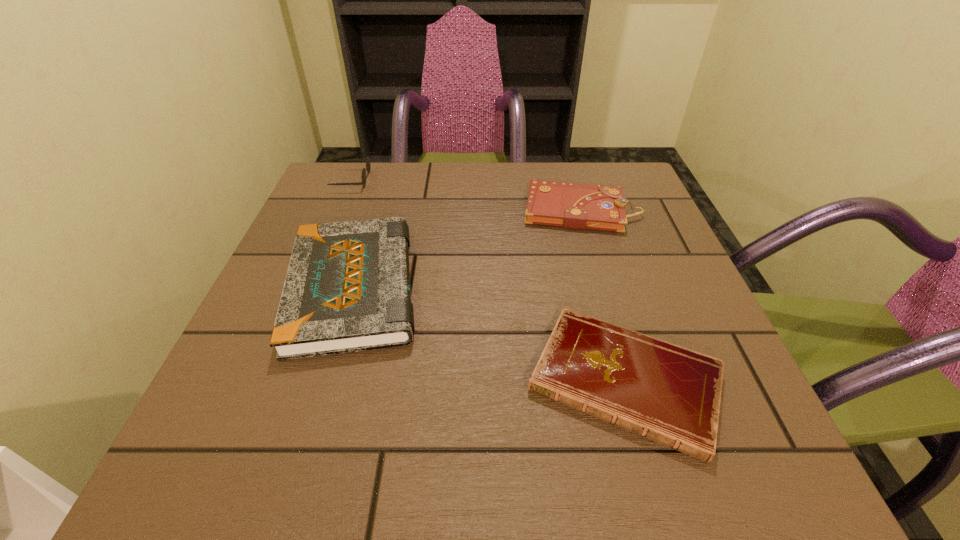
The height and width of the screenshot is (540, 960). I want to click on object identified as the closest to the second shortest object, so click(347, 289).

Identify which object is the third nearest to the leftmost notebook. Please provide its 2D coordinates. Your answer should be formatted as a tuple, i.e. [(x, y)], where the tuple contains the x and y coordinates of a point satisfying the conditions above.

[(579, 206)]

Where is `notebook that can be found as the closest to the sunglasses`? This screenshot has width=960, height=540. notebook that can be found as the closest to the sunglasses is located at coordinates [x=347, y=289].

What are the coordinates of `notebook that is the closest to the shortest notebook` in the screenshot? It's located at (347, 289).

Find the location of a particular element. The width and height of the screenshot is (960, 540). vacant point that satisfies the following two spatial constraints: 1. on the back side of the leftmost notebook; 2. on the front-facing side of the sunglasses is located at coordinates (385, 180).

The image size is (960, 540). What are the coordinates of `free space that satisfies the following two spatial constraints: 1. on the front-facing side of the leftmost notebook; 2. on the right side of the sunglasses` in the screenshot? It's located at (307, 288).

The width and height of the screenshot is (960, 540). In order to click on blank area in the image that satisfies the following two spatial constraints: 1. on the front-facing side of the leftmost notebook; 2. on the left side of the sunglasses in this screenshot , I will do `click(307, 288)`.

The height and width of the screenshot is (540, 960). In order to click on free spot that satisfies the following two spatial constraints: 1. on the back side of the leftmost notebook; 2. on the front-facing side of the sunglasses in this screenshot , I will do `click(385, 180)`.

Image resolution: width=960 pixels, height=540 pixels. Find the location of `free location that satisfies the following two spatial constraints: 1. on the front-facing side of the shortest object; 2. on the left side of the sunglasses`. free location that satisfies the following two spatial constraints: 1. on the front-facing side of the shortest object; 2. on the left side of the sunglasses is located at coordinates (269, 381).

Locate an element on the screen. The height and width of the screenshot is (540, 960). free space that satisfies the following two spatial constraints: 1. on the back side of the third tallest object; 2. on the front-facing side of the sunglasses is located at coordinates (572, 180).